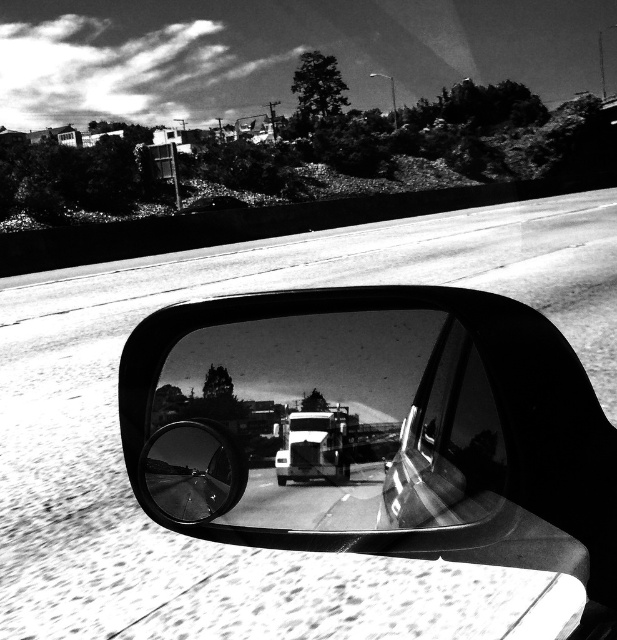
You are a passenger in the car and notice a shiny chrome mirror at center. Where exactly is the shiny chrome mirror at center located in relation to the point marked at coordinates point (193, 470)?

The shiny chrome mirror at center is located exactly at point (193, 470).

You are a passenger in a car and want to check if the metallic silver trailer truck at center is visible in the polished chrome car window at center. Based on their positions, can you confirm if the truck is reflected in the window?

The polished chrome car window at center is positioned on the right side of the metallic silver trailer truck at center, so the truck should be visible in the reflection of the window since it is directly to the right of the window.